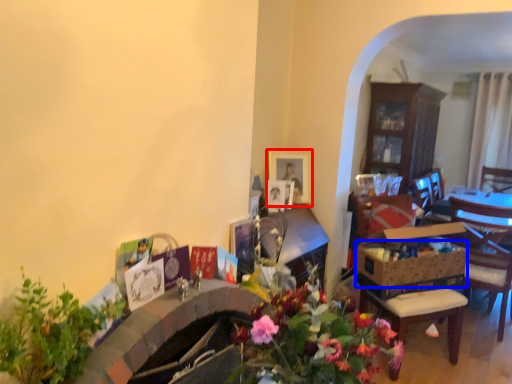
Question: Which point is further to the camera, picture frame (highlighted by a red box) or flower basket (highlighted by a blue box)?

Choices:
 (A) picture frame
 (B) flower basket

Answer: (A)